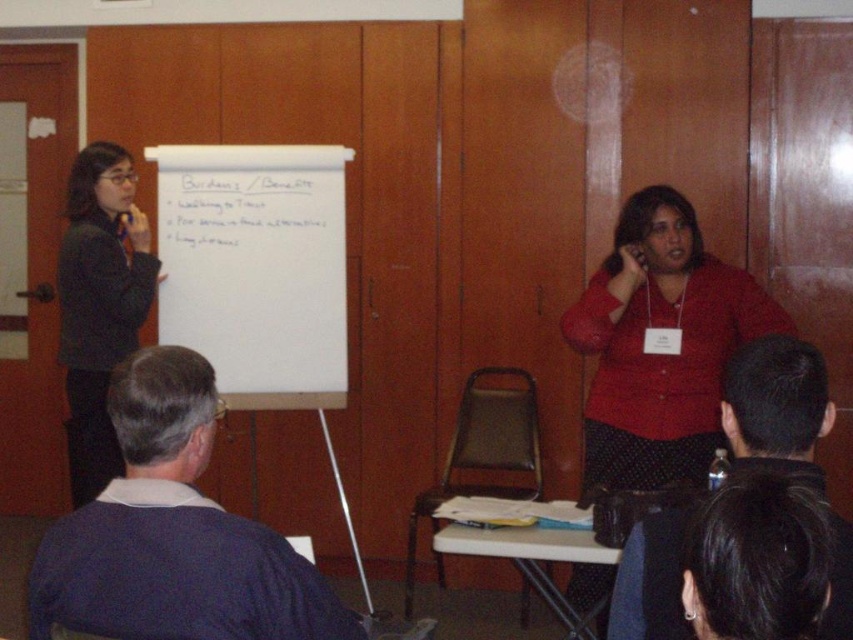
Question: Can you confirm if matte red blouse at center is wider than white paper at upper center?

Choices:
 (A) yes
 (B) no

Answer: (B)

Question: Which object appears closest to the camera in this image?

Choices:
 (A) black fabric shirt at upper center
 (B) matte black jacket at left
 (C) whiteboard at upper left
 (D) matte red blouse at center

Answer: (A)

Question: Does black fabric shirt at upper center have a larger size compared to matte black jacket at left?

Choices:
 (A) yes
 (B) no

Answer: (B)

Question: Which of the following is the closest to the observer?

Choices:
 (A) (326, 193)
 (B) (219, 520)
 (C) (793, 368)

Answer: (C)

Question: Which of the following is the farthest from the observer?

Choices:
 (A) (323, 356)
 (B) (207, 198)
 (C) (624, 461)

Answer: (B)

Question: Is dark blue sweater at left closer to camera compared to matte black jacket at left?

Choices:
 (A) yes
 (B) no

Answer: (A)